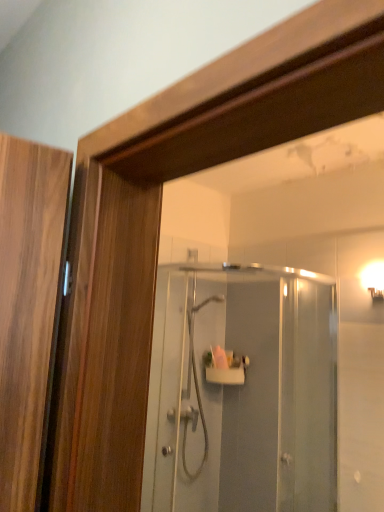
Measure the distance between white glossy wall sconce at upper right and camera.

white glossy wall sconce at upper right and camera are 7.45 feet apart from each other.

At what (x,y) coordinates should I click in order to perform the action: click on clear glass shower door at center. Please return your answer as a coordinate pair (x, y). The height and width of the screenshot is (512, 384). Looking at the image, I should click on (242, 390).

Locate an element on the screen. white glossy shower at center is located at coordinates coord(195,385).

Considering the positions of objects clear glass shower door at center and white glossy shower at center in the image provided, who is in front, clear glass shower door at center or white glossy shower at center?

clear glass shower door at center is more forward.

Which of these two, clear glass shower door at center or white glossy shower at center, stands taller?

With more height is clear glass shower door at center.

Consider the image. Is clear glass shower door at center inside or outside of white glossy shower at center?

clear glass shower door at center exists outside the volume of white glossy shower at center.

Between point (191, 413) and point (191, 503), which one is positioned in front?

Positioned in front is point (191, 503).

Does white glossy shower at center appear on the left side of clear glass shower door at center?

Correct, you'll find white glossy shower at center to the left of clear glass shower door at center.

Identify the location of shower on the left of clear glass shower door at center. (195, 385).

From a real-world perspective, is white glossy shower at center physically located above or below clear glass shower door at center?

white glossy shower at center is situated lower than clear glass shower door at center in the real world.

From a real-world perspective, is white glossy shower at center under white glossy wall sconce at upper right?

Yes, from a real-world perspective, white glossy shower at center is beneath white glossy wall sconce at upper right.

Is white glossy shower at center positioned with its back to white glossy wall sconce at upper right?

white glossy shower at center is not turned away from white glossy wall sconce at upper right.

Relative to white glossy wall sconce at upper right, is white glossy shower at center in front or behind?

Visually, white glossy shower at center is located behind white glossy wall sconce at upper right.

Considering the sizes of objects white glossy shower at center and white glossy wall sconce at upper right in the image provided, who is shorter, white glossy shower at center or white glossy wall sconce at upper right?

white glossy wall sconce at upper right.

Based on their positions, is clear glass shower door at center located to the left or right of white glossy wall sconce at upper right?

In the image, clear glass shower door at center appears on the left side of white glossy wall sconce at upper right.

Is clear glass shower door at center closer to the viewer compared to white glossy wall sconce at upper right?

Yes, clear glass shower door at center is closer to the camera.

Which is behind, point (238, 383) or point (382, 298)?

The point (238, 383) is farther from the camera.

Are clear glass shower door at center and white glossy wall sconce at upper right making contact?

clear glass shower door at center and white glossy wall sconce at upper right are not in contact.

Which is nearer, (368, 279) or (190, 322)?

The point (368, 279) is more forward.

Where is `shower located underneath the white glossy wall sconce at upper right (from a real-world perspective)`? This screenshot has height=512, width=384. shower located underneath the white glossy wall sconce at upper right (from a real-world perspective) is located at coordinates [x=195, y=385].

From the image's perspective, is white glossy wall sconce at upper right located above white glossy shower at center?

Yes.

Considering the sizes of objects white glossy wall sconce at upper right and white glossy shower at center in the image provided, who is thinner, white glossy wall sconce at upper right or white glossy shower at center?

Thinner between the two is white glossy wall sconce at upper right.

From a real-world perspective, who is located lower, white glossy wall sconce at upper right or clear glass shower door at center?

From a 3D spatial view, clear glass shower door at center is below.

From the picture: In terms of height, does white glossy wall sconce at upper right look taller or shorter compared to clear glass shower door at center?

In the image, white glossy wall sconce at upper right appears to be shorter than clear glass shower door at center.

How distant is white glossy wall sconce at upper right from clear glass shower door at center?

A distance of 38.96 inches exists between white glossy wall sconce at upper right and clear glass shower door at center.

Identify the location of screen door on the right of the white glossy shower at center. Image resolution: width=384 pixels, height=512 pixels. (242, 390).

This screenshot has width=384, height=512. Find the location of `shower below the clear glass shower door at center (from the image's perspective)`. shower below the clear glass shower door at center (from the image's perspective) is located at coordinates (195, 385).

Looking at the image, which one is located closer to clear glass shower door at center, white glossy wall sconce at upper right or white glossy shower at center?

white glossy shower at center is positioned closer to the anchor clear glass shower door at center.

Based on their spatial positions, is clear glass shower door at center or white glossy wall sconce at upper right closer to white glossy shower at center?

Based on the image, clear glass shower door at center appears to be nearer to white glossy shower at center.

Considering their positions, is clear glass shower door at center positioned further to white glossy wall sconce at upper right than white glossy shower at center?

Based on the image, white glossy shower at center appears to be further to white glossy wall sconce at upper right.

Considering their positions, is white glossy shower at center positioned closer to white glossy wall sconce at upper right than clear glass shower door at center?

clear glass shower door at center.

Based on their spatial positions, is white glossy wall sconce at upper right or clear glass shower door at center closer to white glossy shower at center?

clear glass shower door at center lies closer to white glossy shower at center than the other object.

Looking at the image, which one is located closer to clear glass shower door at center, white glossy shower at center or white glossy wall sconce at upper right?

white glossy shower at center is closer to clear glass shower door at center.

Find the location of `screen door located between white glossy shower at center and white glossy wall sconce at upper right in the left-right direction`. screen door located between white glossy shower at center and white glossy wall sconce at upper right in the left-right direction is located at coordinates (242, 390).